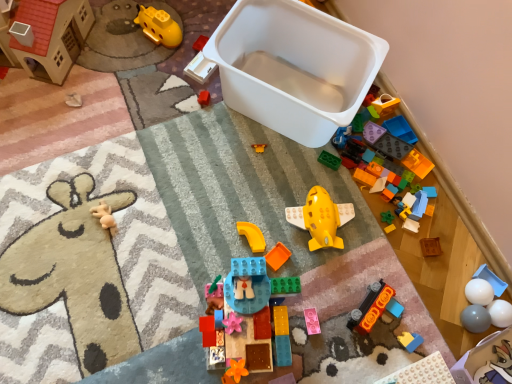
You are a GUI agent. You are given a task and a screenshot of the screen. Output one action in this format:
    pyautogui.click(x=<x>, y=<y>)
    Task: Click on the vacant area situated to the left side of yellow plastic submarine at upper left, which ranks as the fourteenth toy in right-to-left order
    
    Given the screenshot: What is the action you would take?
    pyautogui.click(x=113, y=33)